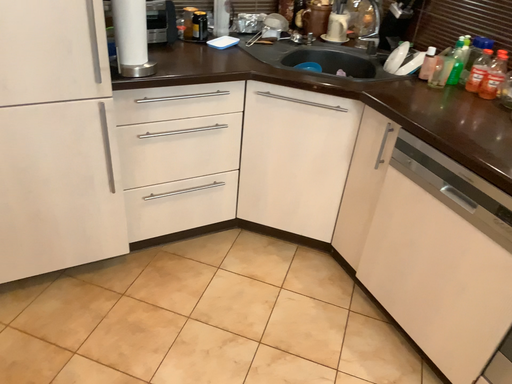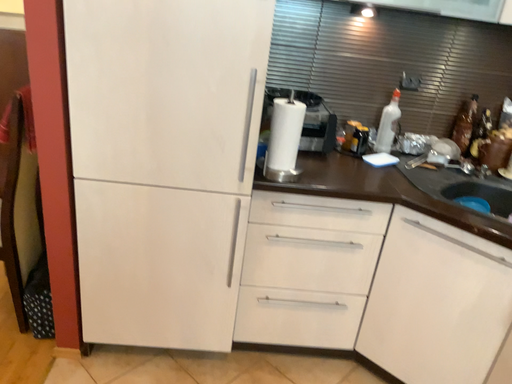
Question: Which way did the camera rotate in the video?

Choices:
 (A) rotated downward
 (B) rotated upward

Answer: (B)